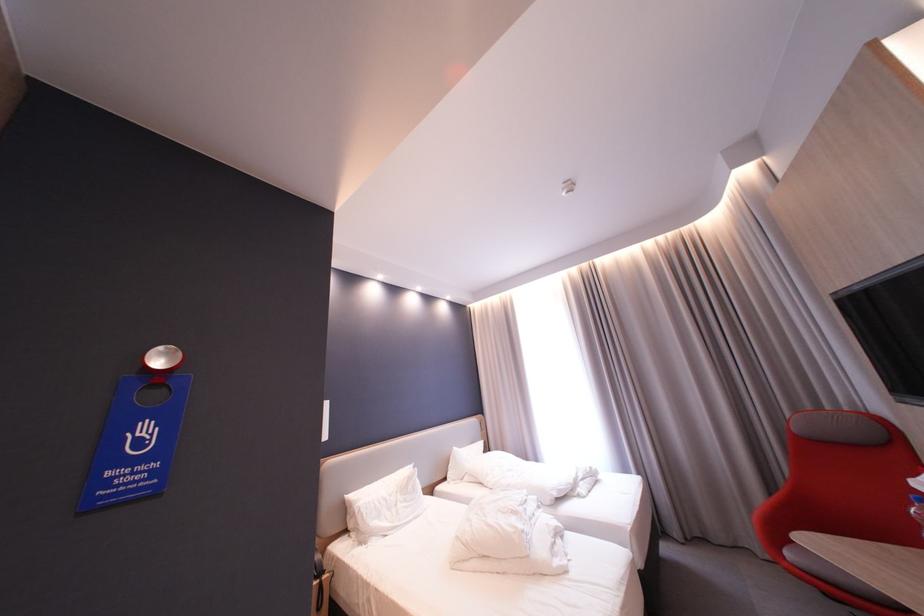
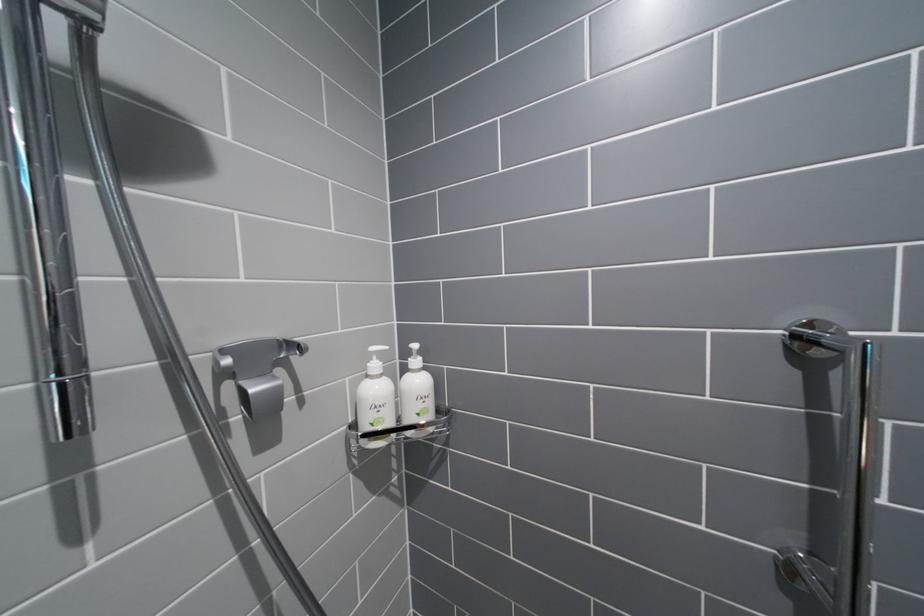
What movement of the cameraman would produce the second image?

The cameraman moved toward left, forward.